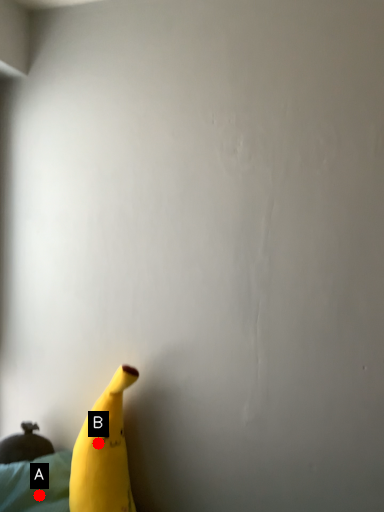
Question: Two points are circled on the image, labeled by A and B beside each circle. Which point is further to the camera?

Choices:
 (A) A is further
 (B) B is further

Answer: (A)